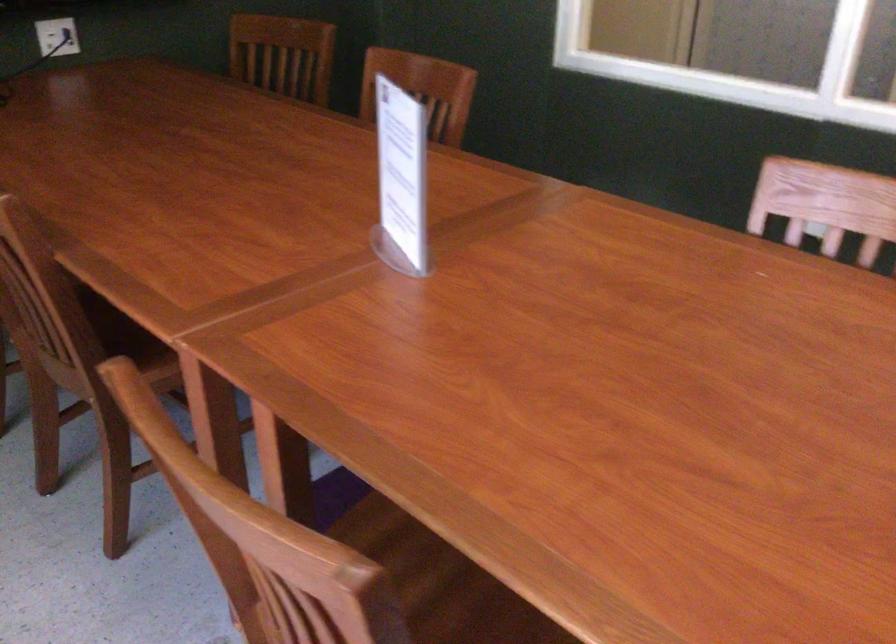
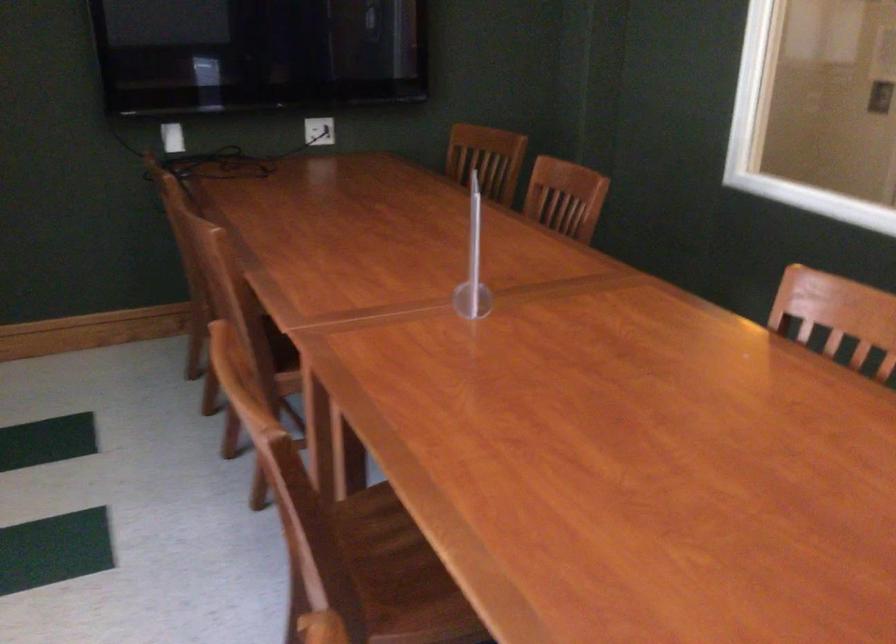
Question: The camera is either moving clockwise (left) or counter-clockwise (right) around the object. The first image is from the beginning of the video and the second image is from the end. Is the camera moving left or right when shooting the video?

Choices:
 (A) Left
 (B) Right

Answer: (B)